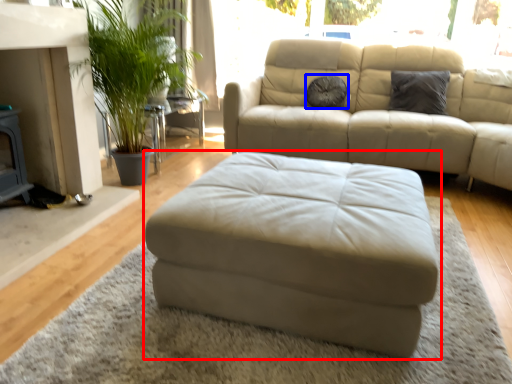
Question: Which of the following is the closest to the observer, studio couch (highlighted by a red box) or pillow (highlighted by a blue box)?

Choices:
 (A) studio couch
 (B) pillow

Answer: (A)